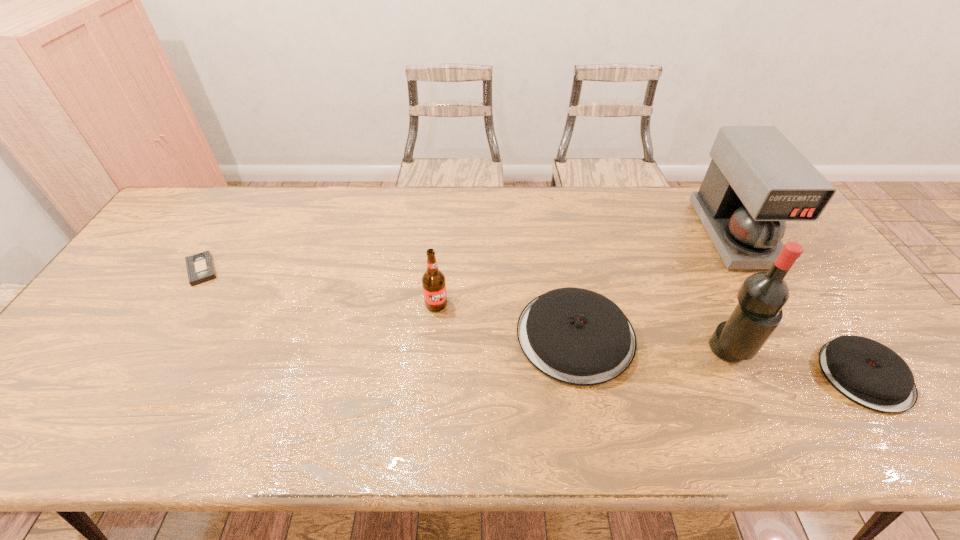
Where is `root beer`? The height and width of the screenshot is (540, 960). root beer is located at coordinates (433, 280).

Where is `free region located on the back of the taller pancake`? Image resolution: width=960 pixels, height=540 pixels. free region located on the back of the taller pancake is located at coordinates (559, 245).

Identify the location of vacant space located 0.250m on the back of the fifth tallest object. This screenshot has width=960, height=540. (792, 271).

Image resolution: width=960 pixels, height=540 pixels. Find the location of `free space located 0.290m on the right of the leftmost object`. free space located 0.290m on the right of the leftmost object is located at coordinates (320, 270).

Locate an element on the screen. Image resolution: width=960 pixels, height=540 pixels. vacant space located 0.230m on the carafe side of the second tallest object is located at coordinates (796, 336).

The width and height of the screenshot is (960, 540). Find the location of `free point located on the back of the third object from right to left`. free point located on the back of the third object from right to left is located at coordinates (677, 241).

Locate an element on the screen. The image size is (960, 540). free location located on the right of the fourth shortest object is located at coordinates (542, 304).

Locate an element on the screen. Image resolution: width=960 pixels, height=540 pixels. object that is at the far edge is located at coordinates (757, 180).

This screenshot has height=540, width=960. I want to click on wine bottle that is at the near edge, so click(x=762, y=296).

Where is `object that is at the left edge`? object that is at the left edge is located at coordinates (200, 268).